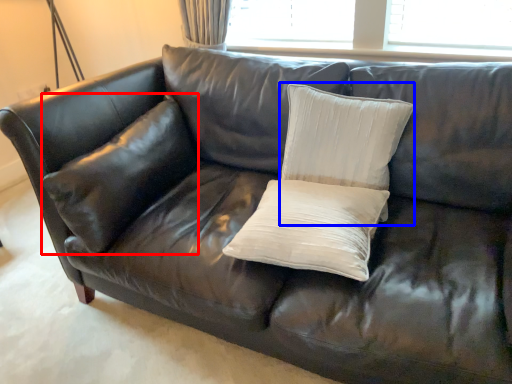
Question: Which point is closer to the camera, pillow (highlighted by a red box) or pillow (highlighted by a blue box)?

Choices:
 (A) pillow
 (B) pillow

Answer: (B)